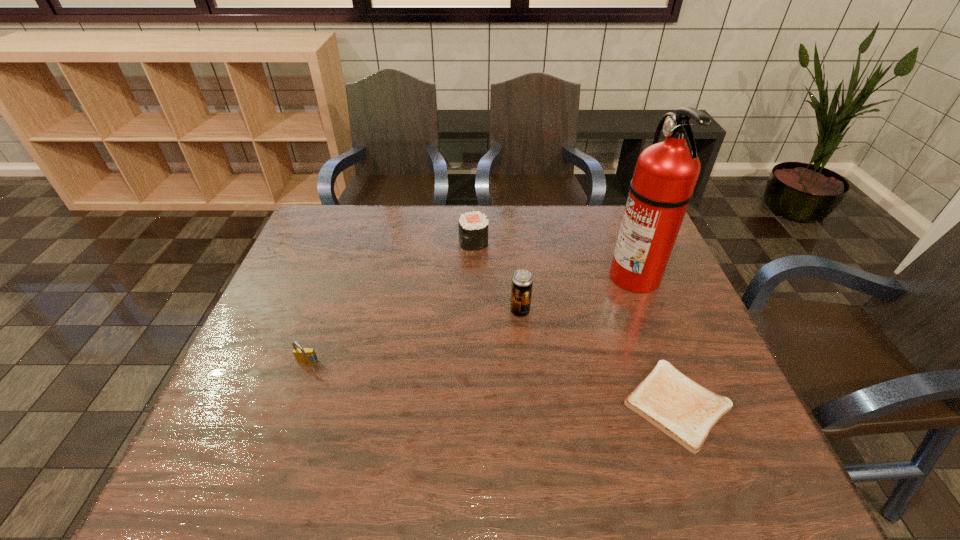
This screenshot has height=540, width=960. I want to click on vacant space at the near edge, so click(x=321, y=470).

This screenshot has width=960, height=540. Identify the location of vacant space at the left edge of the desktop. (275, 337).

In the image, there is a desktop. Identify the location of vacant area at the right edge. (638, 321).

This screenshot has width=960, height=540. In the image, there is a desktop. In order to click on free space at the near left corner in this screenshot , I will do (273, 456).

Where is `free space between the beer can and the fourth object from right to left`? The image size is (960, 540). free space between the beer can and the fourth object from right to left is located at coordinates (496, 276).

Locate an element on the screen. Image resolution: width=960 pixels, height=540 pixels. vacant area that lies between the beer can and the tallest object is located at coordinates pyautogui.click(x=577, y=293).

This screenshot has width=960, height=540. In order to click on vacant area between the sushi and the toast in this screenshot , I will do `click(575, 323)`.

The image size is (960, 540). Identify the location of free area in between the third object from right to left and the fourth object from right to left. (496, 276).

You are a GUI agent. You are given a task and a screenshot of the screen. Output one action in this format:
    pyautogui.click(x=<x>, y=<y>)
    Task: Click on the free space between the second object from left to right and the tallest object
    The width and height of the screenshot is (960, 540).
    Given the screenshot: What is the action you would take?
    pyautogui.click(x=554, y=259)

Identify the location of empty space that is in between the third farthest object and the tallest object. (577, 293).